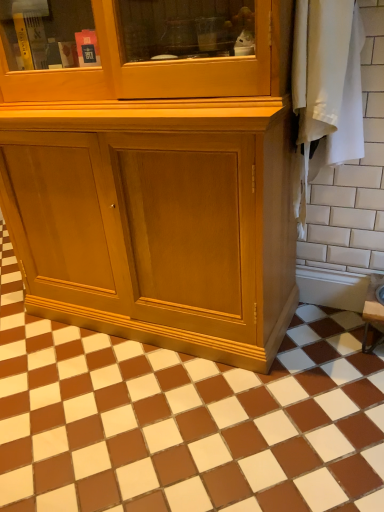
The image size is (384, 512). Find the location of `free point below white ceramic tile at right, the 1th ceramic tile viewed from the right (from a real-world perspective)`. free point below white ceramic tile at right, the 1th ceramic tile viewed from the right (from a real-world perspective) is located at coordinates (321, 323).